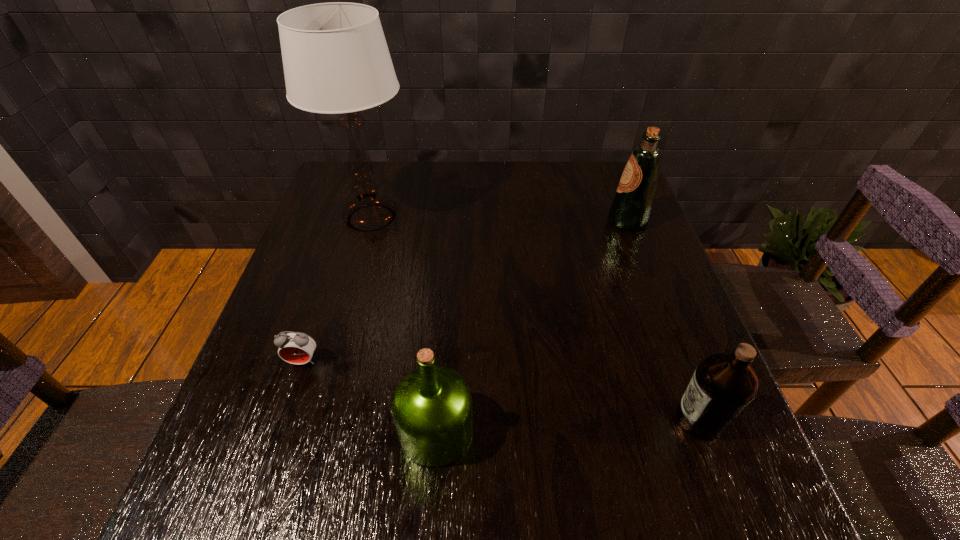
Image resolution: width=960 pixels, height=540 pixels. Find the location of `the tallest object`. the tallest object is located at coordinates (336, 60).

What are the coordinates of `the farthest olive oil` in the screenshot? It's located at (631, 207).

At what (x,y) coordinates should I click in order to perform the action: click on the leftmost olive oil. Please return your answer as a coordinate pair (x, y). Looking at the image, I should click on (431, 406).

Where is `the third farthest object`? Image resolution: width=960 pixels, height=540 pixels. the third farthest object is located at coordinates (297, 348).

The width and height of the screenshot is (960, 540). Identify the location of the shortest object. (297, 348).

At what (x,y) coordinates should I click in order to perform the action: click on free space located on the front-facing side of the tallest object. Please return your answer as a coordinate pair (x, y). This screenshot has width=960, height=540. Looking at the image, I should click on pos(537,218).

You are a GUI agent. You are given a task and a screenshot of the screen. Output one action in this format:
    pyautogui.click(x=<x>, y=<y>)
    Task: Click on the vacant area situated 0.160m on the front-facing side of the farthest olive oil
    
    Given the screenshot: What is the action you would take?
    pyautogui.click(x=549, y=221)

Locate an element on the screen. vacant space located 0.300m on the front-facing side of the farthest olive oil is located at coordinates (499, 221).

Locate an element on the screen. free spot located 0.130m on the front-facing side of the farthest olive oil is located at coordinates (560, 221).

Where is `vacant space located on the right of the third object from left to right`? Image resolution: width=960 pixels, height=540 pixels. vacant space located on the right of the third object from left to right is located at coordinates (668, 431).